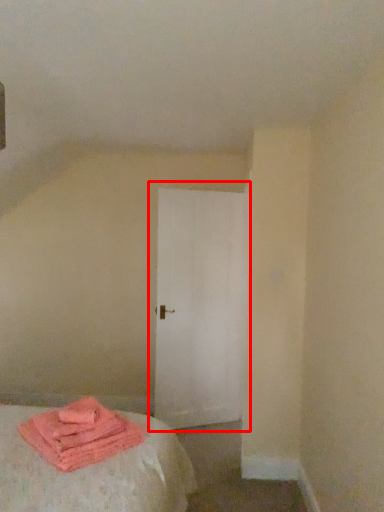
Question: Considering the relative positions of door (annotated by the red box) and material in the image provided, where is door (annotated by the red box) located with respect to the staircase?

Choices:
 (A) right
 (B) left

Answer: (A)